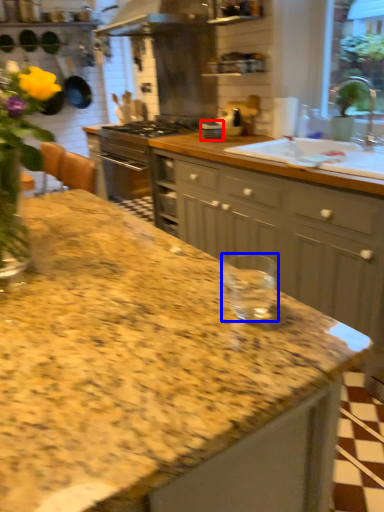
Question: Which object is further to the camera taking this photo, appliance (highlighted by a red box) or glass jar (highlighted by a blue box)?

Choices:
 (A) appliance
 (B) glass jar

Answer: (A)